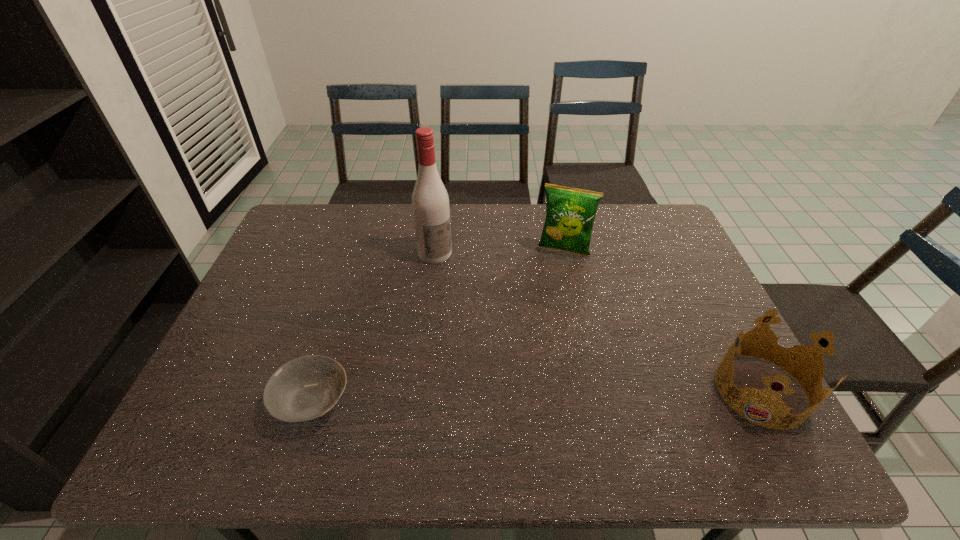
Locate an element on the screen. Image resolution: width=960 pixels, height=540 pixels. free location located 0.120m on the front-facing side of the crisp (potato chip) is located at coordinates (550, 285).

Identify the location of vacant point located on the front-facing side of the crisp (potato chip). This screenshot has width=960, height=540. (552, 279).

You are a GUI agent. You are given a task and a screenshot of the screen. Output one action in this format:
    pyautogui.click(x=<x>, y=<y>)
    Task: Click on the free location located 0.170m on the front-facing side of the crisp (potato chip)
    The image size is (960, 540).
    Given the screenshot: What is the action you would take?
    pyautogui.click(x=546, y=296)

Identify the location of free location located on the label of the alcohol. The image size is (960, 540). (487, 323).

Where is `free space located on the label of the alcohol`? This screenshot has width=960, height=540. free space located on the label of the alcohol is located at coordinates (510, 355).

I want to click on vacant space located 0.150m on the label of the alcohol, so click(465, 293).

The width and height of the screenshot is (960, 540). In order to click on crisp (potato chip) that is at the far edge in this screenshot , I will do `click(570, 213)`.

Where is `alcohol at the far edge`? The image size is (960, 540). alcohol at the far edge is located at coordinates (430, 202).

Image resolution: width=960 pixels, height=540 pixels. I want to click on bowl that is at the near edge, so click(x=305, y=388).

Identify the location of crown present at the near edge. The width and height of the screenshot is (960, 540). (810, 353).